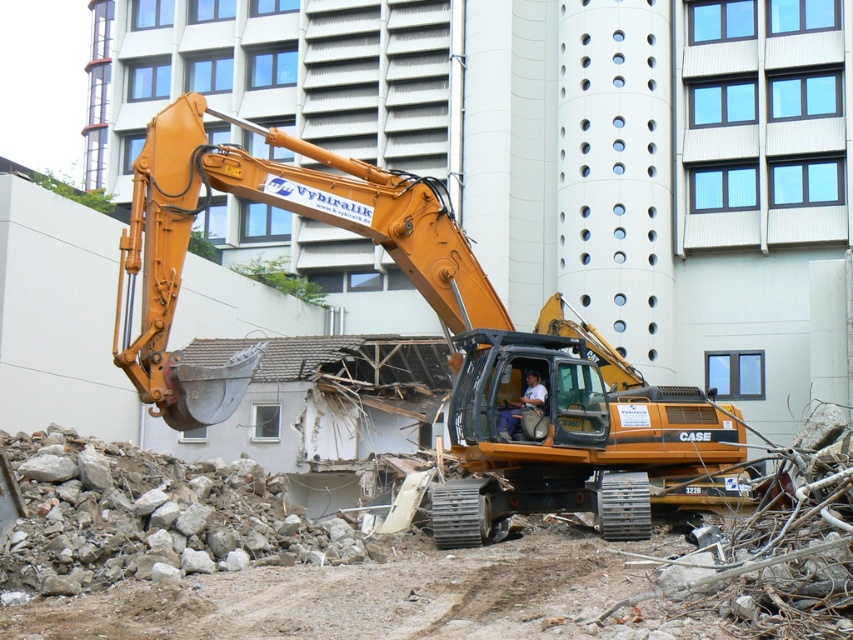
Question: Can you confirm if orange metallic excavator at center is thinner than light brown leather jacket at center?

Choices:
 (A) yes
 (B) no

Answer: (B)

Question: Which point appears closest to the camera in this image?

Choices:
 (A) (532, 378)
 (B) (440, 292)

Answer: (B)

Question: Which of the following is the closest to the observer?

Choices:
 (A) light brown leather jacket at center
 (B) orange metallic excavator at center

Answer: (B)

Question: Does orange metallic excavator at center lie in front of light brown leather jacket at center?

Choices:
 (A) yes
 (B) no

Answer: (A)

Question: Does orange metallic excavator at center have a larger size compared to light brown leather jacket at center?

Choices:
 (A) no
 (B) yes

Answer: (B)